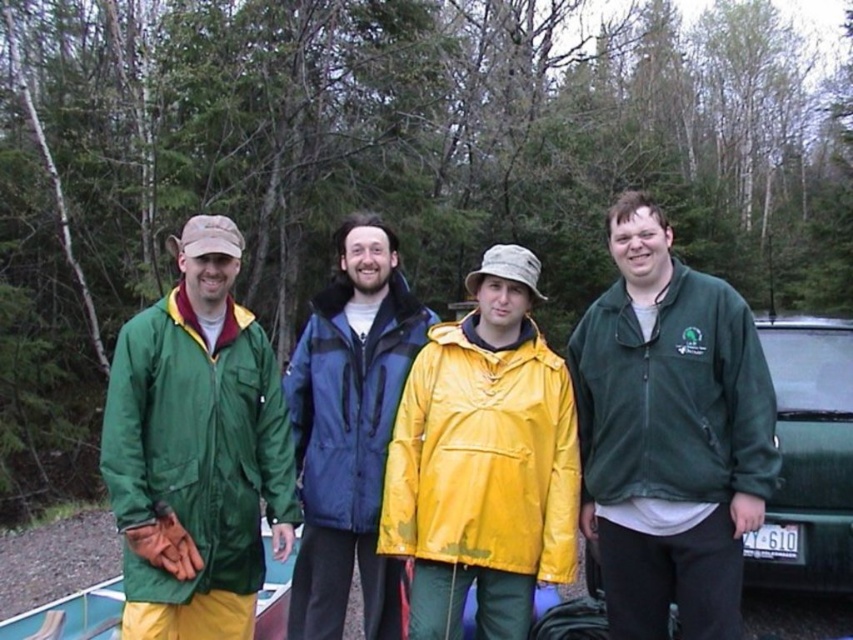
Does blue/gray synthetic jacket at center appear on the left side of green matte car at right?

Indeed, blue/gray synthetic jacket at center is positioned on the left side of green matte car at right.

Is blue/gray synthetic jacket at center above green matte car at right?

Yes, blue/gray synthetic jacket at center is above green matte car at right.

Describe the element at coordinates (349, 401) in the screenshot. I see `blue/gray synthetic jacket at center` at that location.

This screenshot has width=853, height=640. Identify the location of blue/gray synthetic jacket at center. (349, 401).

Which is below, green matte jacket at left or green matte car at right?

green matte car at right is lower down.

Does green matte jacket at left have a smaller size compared to green matte car at right?

Yes, green matte jacket at left is smaller than green matte car at right.

The image size is (853, 640). What do you see at coordinates (196, 445) in the screenshot?
I see `green matte jacket at left` at bounding box center [196, 445].

Image resolution: width=853 pixels, height=640 pixels. I want to click on green matte jacket at left, so click(x=196, y=445).

Does yellow matte jacket at center appear under green matte car at right?

Indeed, yellow matte jacket at center is positioned under green matte car at right.

Does point (503, 477) lie in front of point (785, 397)?

Yes, point (503, 477) is in front of point (785, 397).

You are a GUI agent. You are given a task and a screenshot of the screen. Output one action in this format:
    pyautogui.click(x=<x>, y=<y>)
    Task: Click on the yellow matte jacket at center
    Image resolution: width=853 pixels, height=640 pixels.
    Given the screenshot: What is the action you would take?
    pyautogui.click(x=485, y=456)